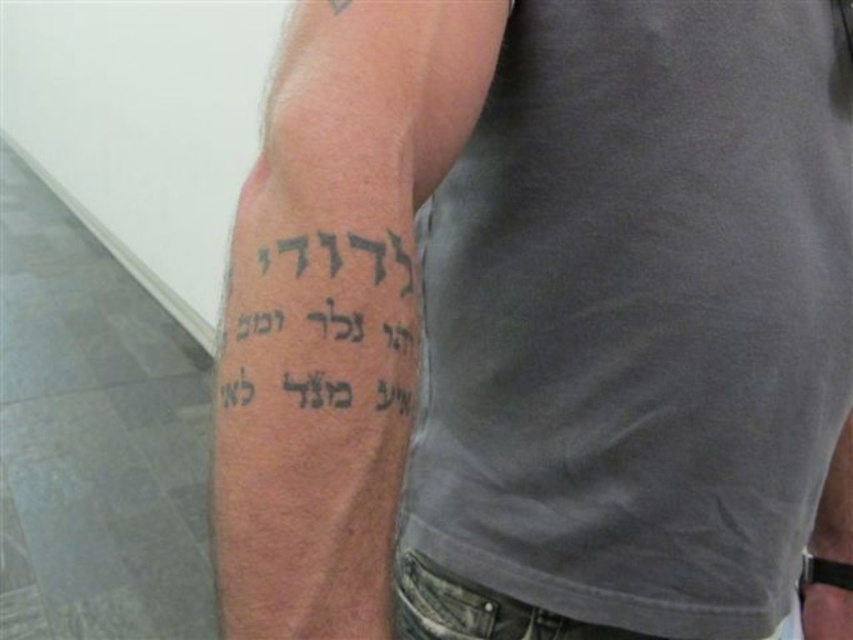
You are a tattoo artist who needs to place a new tattoo on the inner forearm. The client wants it positioned exactly at point 0.483, 0.392. You see the existing black ink tattoo at upper left. Can you confirm if the new tattoo will overlap with the existing one?

The existing black ink tattoo at upper left is already positioned at point (334, 308), so the new tattoo will overlap with it.

You are a tattoo artist assessing the placement of two tattoos on a client. The client has a black ink text at upper arm and a black ink tattoo at lower left. Based on their positions, which tattoo is closer to the shoulder?

The black ink text at upper arm is closer to the shoulder because it is positioned over the black ink tattoo at lower left, indicating it is higher up on the arm.

What are the coordinates of the black ink text at upper arm?

The black ink text at upper arm is located at point (320,323).